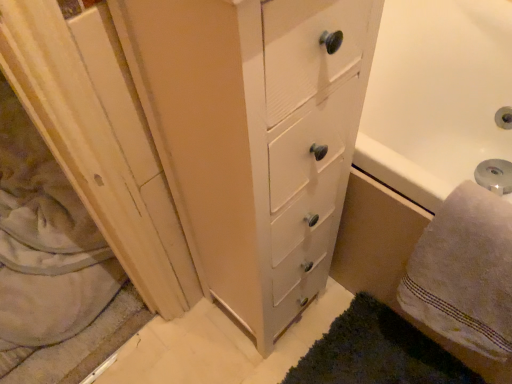
Question: Is wooden screen door at left a part of dark green shaggy rug at lower right?

Choices:
 (A) yes
 (B) no

Answer: (B)

Question: Is dark green shaggy rug at lower right taller than wooden screen door at left?

Choices:
 (A) yes
 (B) no

Answer: (B)

Question: Considering the relative sizes of dark green shaggy rug at lower right and wooden screen door at left in the image provided, is dark green shaggy rug at lower right smaller than wooden screen door at left?

Choices:
 (A) no
 (B) yes

Answer: (B)

Question: Is dark green shaggy rug at lower right far from wooden screen door at left?

Choices:
 (A) no
 (B) yes

Answer: (A)

Question: Is dark green shaggy rug at lower right facing towards wooden screen door at left?

Choices:
 (A) yes
 (B) no

Answer: (B)

Question: Can you see dark green shaggy rug at lower right touching wooden screen door at left?

Choices:
 (A) no
 (B) yes

Answer: (A)

Question: Does white fluffy towel at lower right have a lesser height compared to wooden screen door at left?

Choices:
 (A) no
 (B) yes

Answer: (A)

Question: Is white fluffy towel at lower right not inside wooden screen door at left?

Choices:
 (A) no
 (B) yes

Answer: (B)

Question: Is white fluffy towel at lower right not close to wooden screen door at left?

Choices:
 (A) no
 (B) yes

Answer: (A)

Question: Is white fluffy towel at lower right turned away from wooden screen door at left?

Choices:
 (A) yes
 (B) no

Answer: (B)

Question: Can you confirm if white fluffy towel at lower right is wider than wooden screen door at left?

Choices:
 (A) no
 (B) yes

Answer: (A)

Question: From a real-world perspective, is white fluffy towel at lower right physically below wooden screen door at left?

Choices:
 (A) yes
 (B) no

Answer: (B)

Question: From the image's perspective, is dark green shaggy rug at lower right over white fluffy towel at lower right?

Choices:
 (A) yes
 (B) no

Answer: (B)